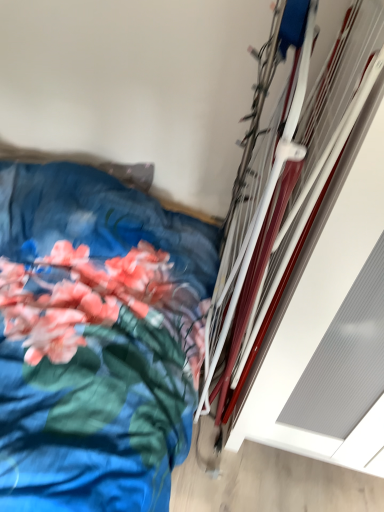
Describe the element at coordinates (80, 449) in the screenshot. Image resolution: width=384 pixels, height=512 pixels. I see `floral fabric bed at left` at that location.

Where is `floral fabric bed at left`? The width and height of the screenshot is (384, 512). floral fabric bed at left is located at coordinates (80, 449).

In order to face floral fabric bed at left, should I rotate leftwards or rightwards?

Turn left by 19.764 degrees to look at floral fabric bed at left.

Locate an element on the screen. floral fabric bed at left is located at coordinates (80, 449).